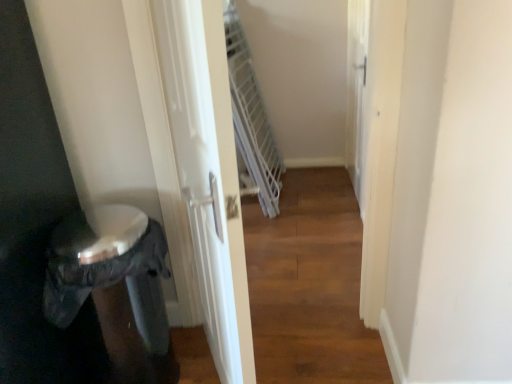
Question: Is white glossy screen door at upper right, which ranks as the 1th screen door in right-to-left order, taller or shorter than white glossy screen door at center, which appears as the first screen door when viewed from the front?

Choices:
 (A) short
 (B) tall

Answer: (A)

Question: Is white glossy screen door at upper right, the 1th screen door viewed from the back, in front of or behind white glossy screen door at center, the second screen door in the back-to-front sequence, in the image?

Choices:
 (A) behind
 (B) front

Answer: (A)

Question: Which of these objects is positioned farthest from the white glossy screen door at upper right, which is the second screen door in front-to-back order?

Choices:
 (A) white glossy screen door at center, which appears as the first screen door when viewed from the front
 (B) black plastic potty at lower left

Answer: (B)

Question: Based on their relative distances, which object is nearer to the black plastic potty at lower left?

Choices:
 (A) white glossy screen door at center, the 2th screen door viewed from the right
 (B) white glossy screen door at upper right, which is the second screen door in front-to-back order

Answer: (A)